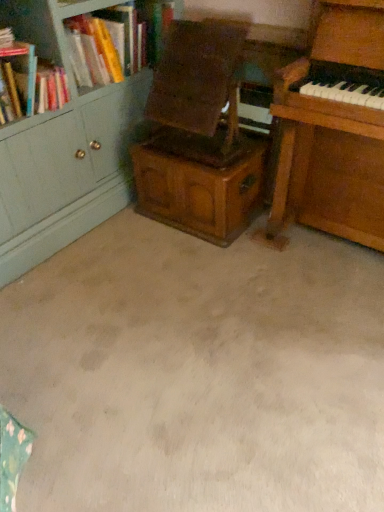
Question: From a real-world perspective, is hardcover book at upper left under wooden bookcase at upper left?

Choices:
 (A) yes
 (B) no

Answer: (B)

Question: Does hardcover book at upper left have a lesser height compared to wooden bookcase at upper left?

Choices:
 (A) no
 (B) yes

Answer: (A)

Question: Can you confirm if hardcover book at upper left is positioned to the right of wooden bookcase at upper left?

Choices:
 (A) yes
 (B) no

Answer: (B)

Question: Can you confirm if hardcover book at upper left is positioned to the left of wooden bookcase at upper left?

Choices:
 (A) yes
 (B) no

Answer: (A)

Question: Are hardcover book at upper left and wooden bookcase at upper left far apart?

Choices:
 (A) yes
 (B) no

Answer: (B)

Question: From the image's perspective, is beige carpet at center positioned above or below wooden cabinet at center?

Choices:
 (A) above
 (B) below

Answer: (B)

Question: Is beige carpet at center taller or shorter than wooden cabinet at center?

Choices:
 (A) short
 (B) tall

Answer: (A)

Question: In the image, is beige carpet at center positioned in front of or behind wooden cabinet at center?

Choices:
 (A) behind
 (B) front

Answer: (B)

Question: In the image, is beige carpet at center on the left side or the right side of wooden cabinet at center?

Choices:
 (A) right
 (B) left

Answer: (A)

Question: Looking at their shapes, would you say beige carpet at center is wider or thinner than wooden piano at right?

Choices:
 (A) wide
 (B) thin

Answer: (A)

Question: From a real-world perspective, is beige carpet at center physically located above or below wooden piano at right?

Choices:
 (A) above
 (B) below

Answer: (B)

Question: Is beige carpet at center in front of or behind wooden piano at right in the image?

Choices:
 (A) behind
 (B) front

Answer: (B)

Question: From the image's perspective, is beige carpet at center located above or below wooden piano at right?

Choices:
 (A) below
 (B) above

Answer: (A)

Question: Considering the positions of wooden bookcase at upper left and wooden armchair at center in the image, is wooden bookcase at upper left taller or shorter than wooden armchair at center?

Choices:
 (A) tall
 (B) short

Answer: (B)

Question: Is wooden bookcase at upper left in front of or behind wooden armchair at center in the image?

Choices:
 (A) behind
 (B) front

Answer: (A)